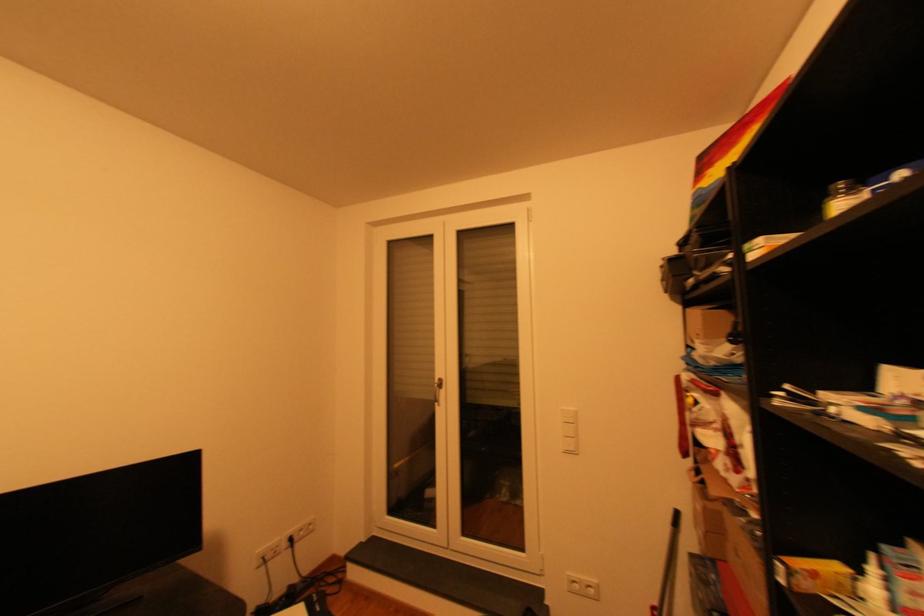
Image resolution: width=924 pixels, height=616 pixels. Find the location of `silver door handle`. silver door handle is located at coordinates (439, 390).